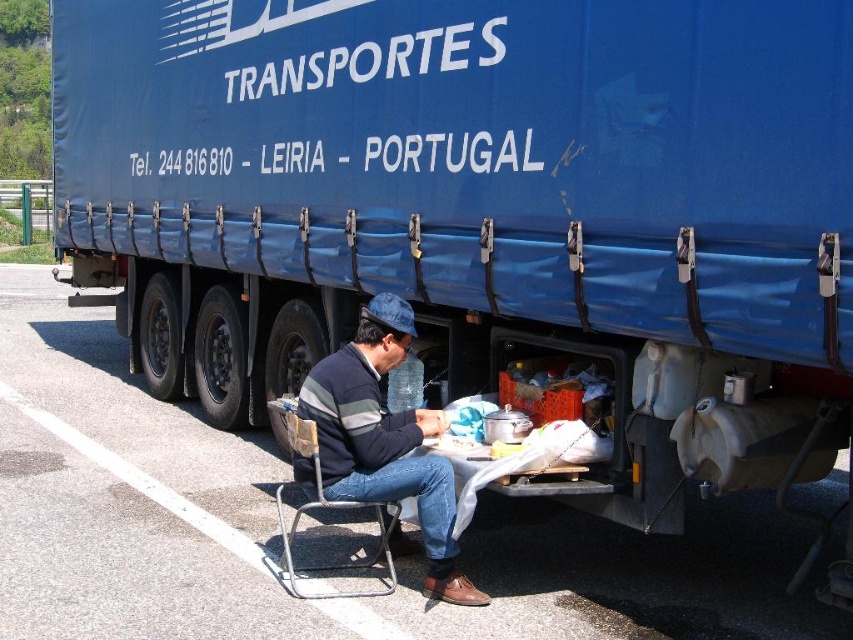
Question: Which object is positioned farthest from the metallic gray folding chair at lower center?

Choices:
 (A) dark blue denim jeans at lower center
 (B) asphalt road at lower left

Answer: (B)

Question: Among these points, which one is farthest from the camera?

Choices:
 (A) (480, 532)
 (B) (287, 588)

Answer: (A)

Question: Is dark blue denim jeans at lower center smaller than metallic gray folding chair at lower center?

Choices:
 (A) no
 (B) yes

Answer: (B)

Question: Which point is farther to the camera?

Choices:
 (A) dark blue denim jeans at lower center
 (B) metallic gray folding chair at lower center

Answer: (B)

Question: Observing the image, what is the correct spatial positioning of asphalt road at lower left in reference to metallic gray folding chair at lower center?

Choices:
 (A) left
 (B) right

Answer: (A)

Question: Does asphalt road at lower left have a greater width compared to metallic gray folding chair at lower center?

Choices:
 (A) yes
 (B) no

Answer: (A)